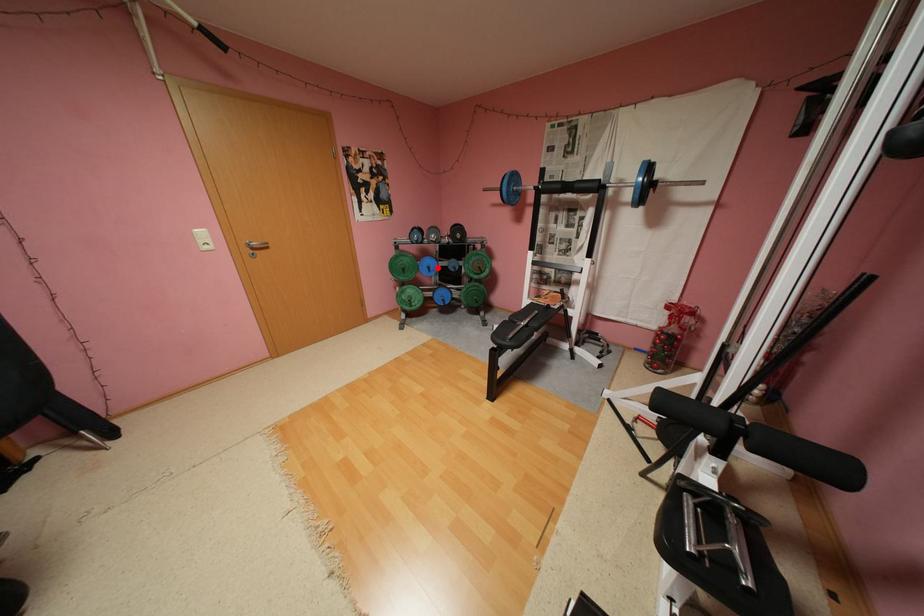
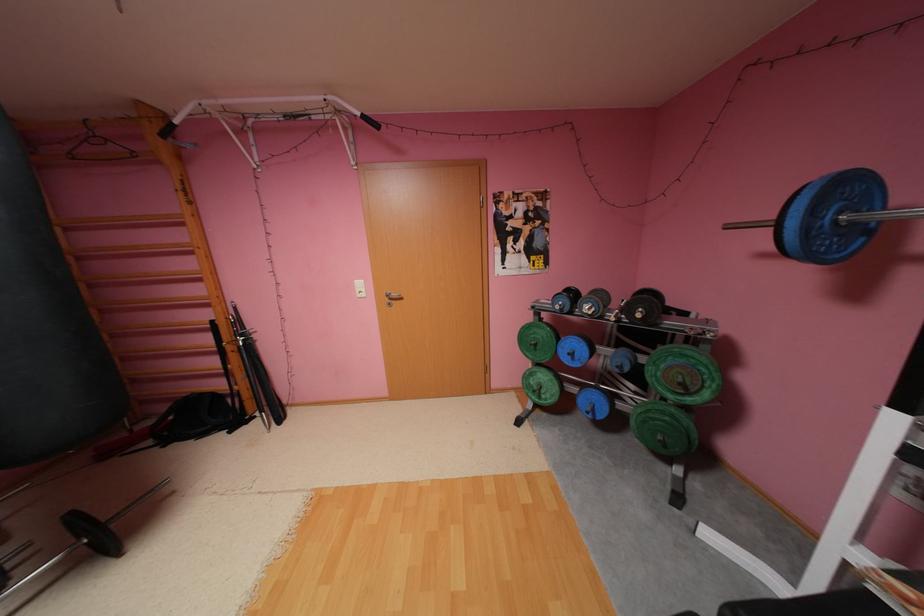
Where in the second image is the point corresponding to the highlighted location from the first image?

(580, 354)